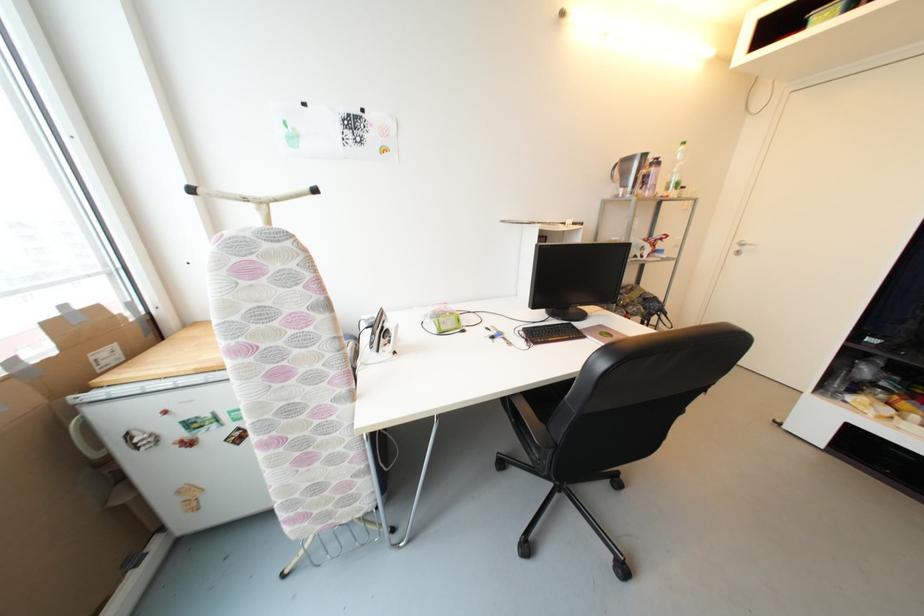
Find where to pull the ironing board handle. Please return your answer as a coordinate pair (x, y).

(250, 195)